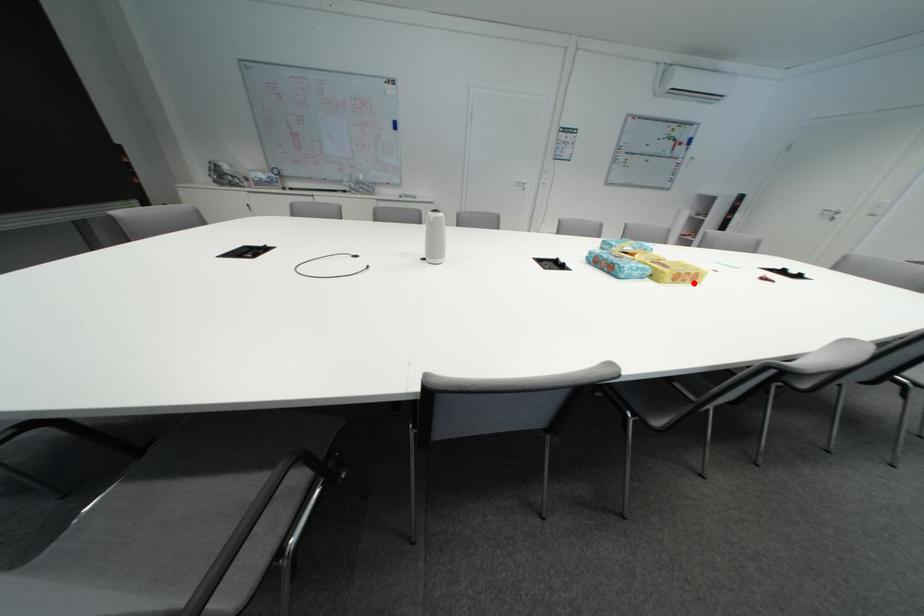
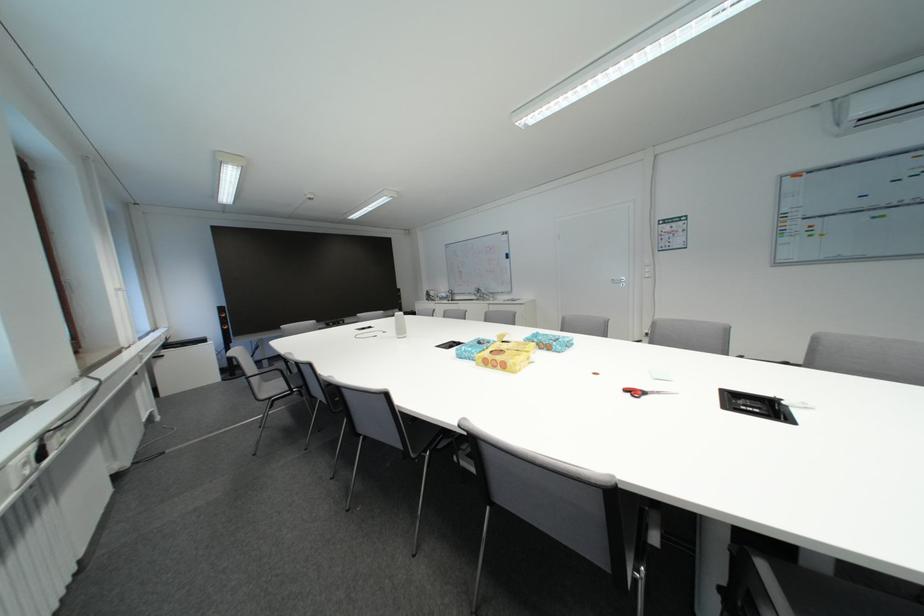
The point at the highlighted location is marked in the first image. Where is the corresponding point in the second image?

(505, 370)